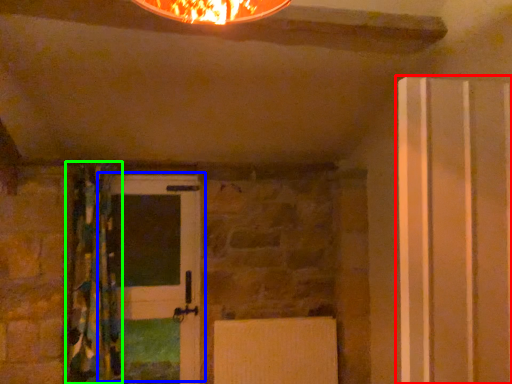
Question: Which object is positioned farthest from door (highlighted by a red box)? Select from door (highlighted by a blue box) and curtain (highlighted by a green box).

Choices:
 (A) door
 (B) curtain

Answer: (B)